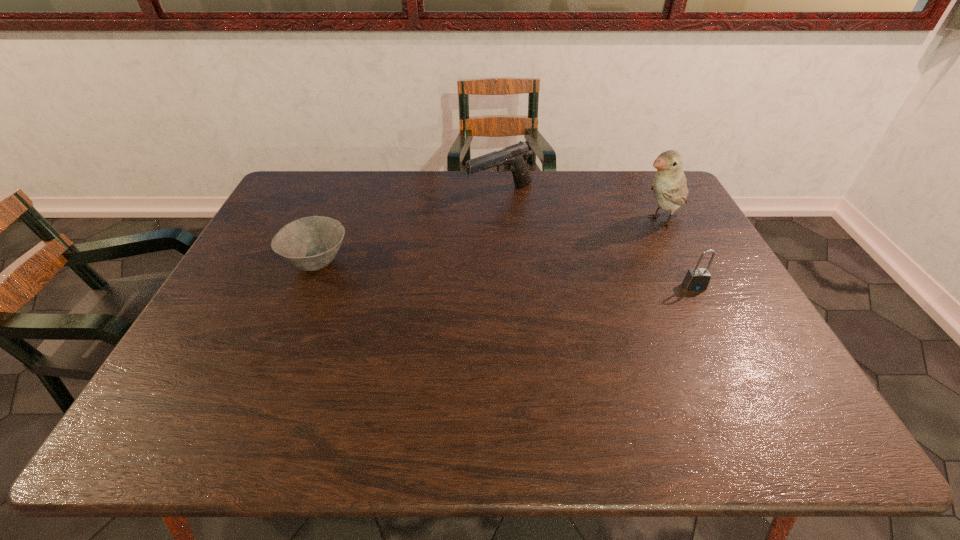
The height and width of the screenshot is (540, 960). Find the location of `free spot between the bird and the leftmost object`. free spot between the bird and the leftmost object is located at coordinates (488, 241).

Find the location of `free area in between the bowl and the third tallest object`. free area in between the bowl and the third tallest object is located at coordinates (506, 274).

Locate an element on the screen. vacant area that lies between the farthest object and the padlock is located at coordinates (597, 240).

This screenshot has height=540, width=960. I want to click on vacant area between the shortest object and the third shortest object, so click(409, 228).

Locate which object is the second closest to the farthest object. Please provide its 2D coordinates. Your answer should be formatted as a tuple, i.e. [(x, y)], where the tuple contains the x and y coordinates of a point satisfying the conditions above.

[(310, 243)]

Select which object is the second closest to the shortest object. Please provide its 2D coordinates. Your answer should be formatted as a tuple, i.e. [(x, y)], where the tuple contains the x and y coordinates of a point satisfying the conditions above.

[(669, 186)]